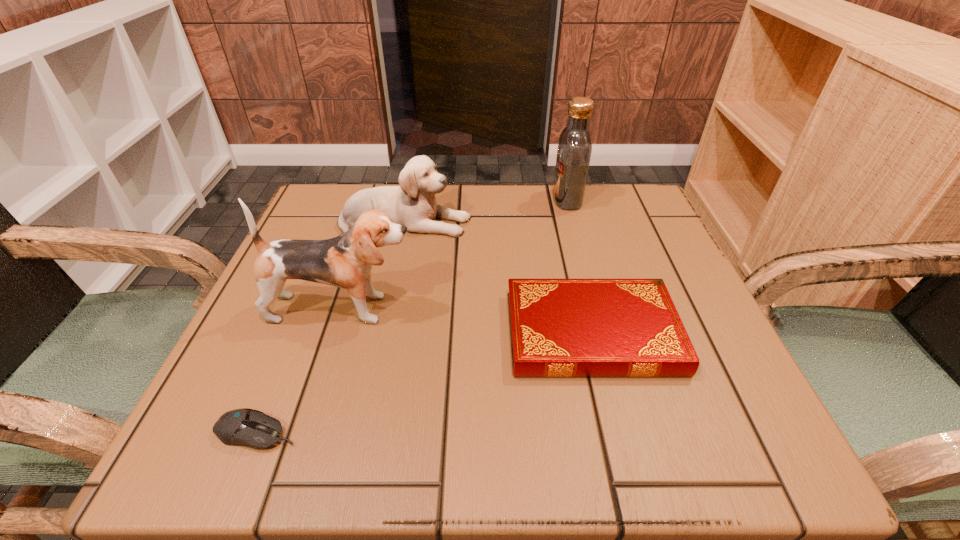
The width and height of the screenshot is (960, 540). Find the location of `free space between the vodka and the fourth tallest object`. free space between the vodka and the fourth tallest object is located at coordinates (580, 266).

The image size is (960, 540). Identify the location of free space between the computer mouse and the taller puppy. 300,370.

Point out which object is positioned as the fourth nearest to the vodka. Please provide its 2D coordinates. Your answer should be formatted as a tuple, i.e. [(x, y)], where the tuple contains the x and y coordinates of a point satisfying the conditions above.

[(246, 427)]

This screenshot has height=540, width=960. In order to click on object that is the closest to the nearer puppy in this screenshot , I will do `click(413, 204)`.

The height and width of the screenshot is (540, 960). I want to click on free space that satisfies the following two spatial constraints: 1. at the face of the taller puppy; 2. on the front side of the computer mouse, so click(303, 433).